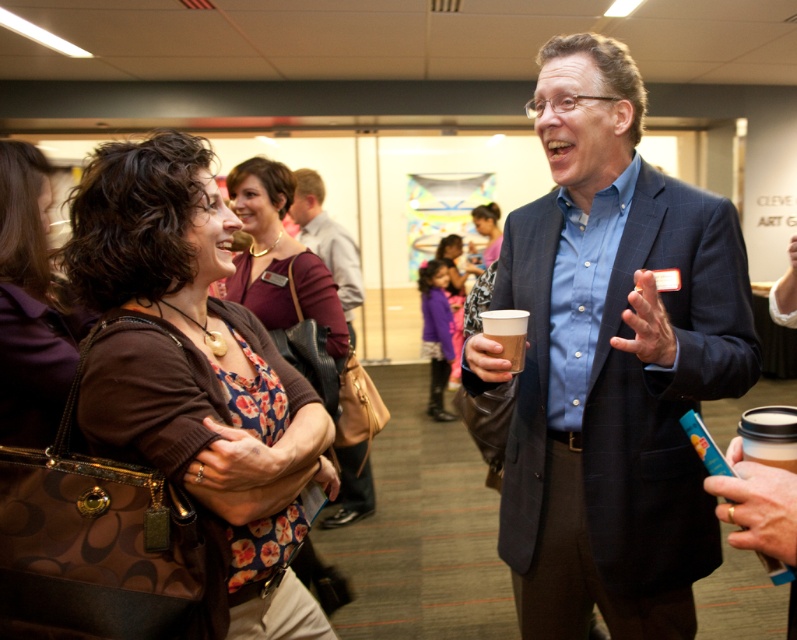
Between purple fuzzy coat at center and brown paper cup at center, which one has more height?

Standing taller between the two is purple fuzzy coat at center.

Locate an element on the screen. purple fuzzy coat at center is located at coordinates (436, 333).

Measure the distance between point (128, 401) and camera.

Point (128, 401) and camera are 38.45 inches apart.

Locate an element on the screen. This screenshot has width=797, height=640. brown leather purse at upper left is located at coordinates (195, 372).

Which is behind, point (118, 289) or point (525, 326)?

Positioned behind is point (525, 326).

At what (x,y) coordinates should I click in order to perform the action: click on brown leather purse at upper left. Please return your answer as a coordinate pair (x, y). The height and width of the screenshot is (640, 797). Looking at the image, I should click on (195, 372).

Who is taller, brown leather purse at upper left or white paper cup at upper right?

Standing taller between the two is brown leather purse at upper left.

Which is more to the right, brown leather purse at upper left or white paper cup at upper right?

From the viewer's perspective, white paper cup at upper right appears more on the right side.

Between point (93, 164) and point (791, 444), which one is positioned behind?

Positioned behind is point (93, 164).

Find the location of a particular element. This screenshot has width=797, height=640. brown leather purse at upper left is located at coordinates pyautogui.click(x=195, y=372).